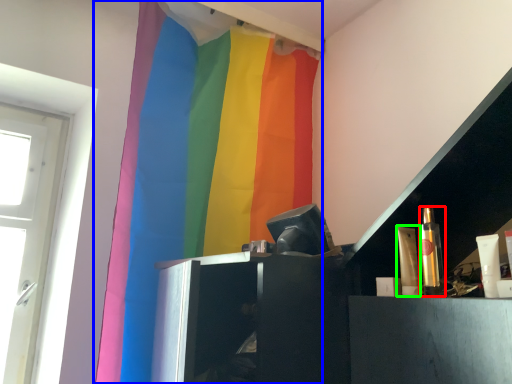
Question: Which object is positioned closest to toiletry (highlighted by a red box)? Select from curtain (highlighted by a blue box) and toiletry (highlighted by a green box).

Choices:
 (A) curtain
 (B) toiletry

Answer: (B)